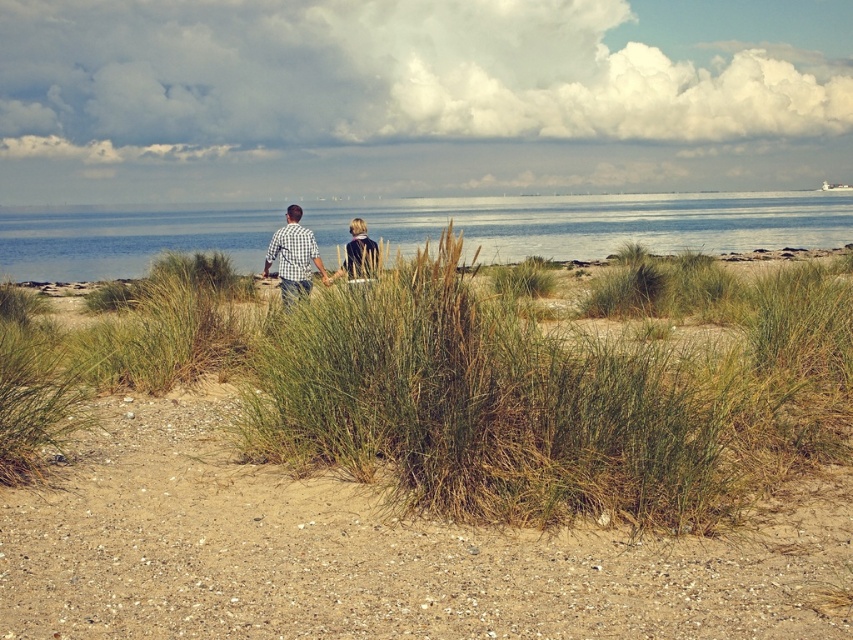
You are a photographer setting up a tripod on the brown sandy soil at lower center. You want to ensure the dark blue jacket at center is visible in the frame. Given their sizes, will the jacket be fully visible without being blocked by the soil?

The brown sandy soil at lower center is smaller than the dark blue jacket at center, so the jacket will be fully visible in the frame without being blocked by the soil.

In the scene shown: You are a photographer trying to capture a photo of the checkered fabric shirt at center while standing on the brown sandy soil at lower center. Can you take the photo without moving from your current position?

The brown sandy soil at lower center is below the checkered fabric shirt at center, so yes, you can take the photo without moving since the shirt is above you.

You are standing at the edge of the beach looking out towards the sea. There are two points marked on the ground in front of you. The first point is at coordinate (196, 620) and the second at (320, 268). Which point is closer to you?

Point (196, 620) is closer to the viewer than point (320, 268).